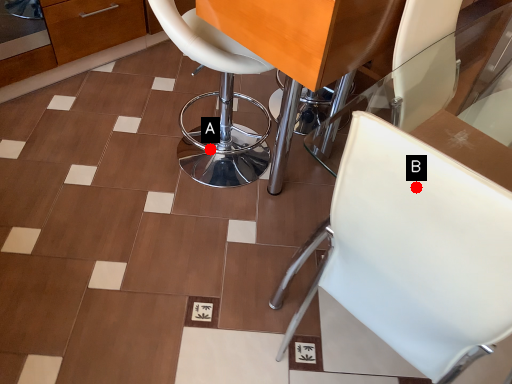
Question: Two points are circled on the image, labeled by A and B beside each circle. Which point appears farthest from the camera in this image?

Choices:
 (A) A is further
 (B) B is further

Answer: (A)